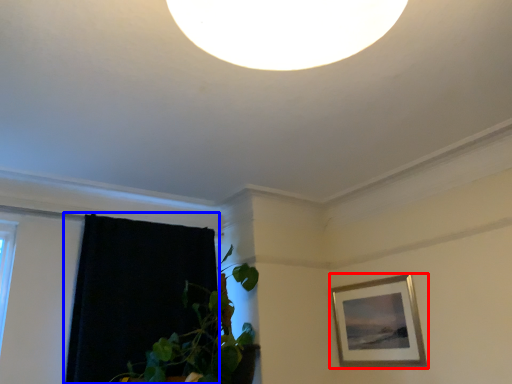
Question: Which object is closer to the camera taking this photo, picture frame (highlighted by a red box) or curtain (highlighted by a blue box)?

Choices:
 (A) picture frame
 (B) curtain

Answer: (B)